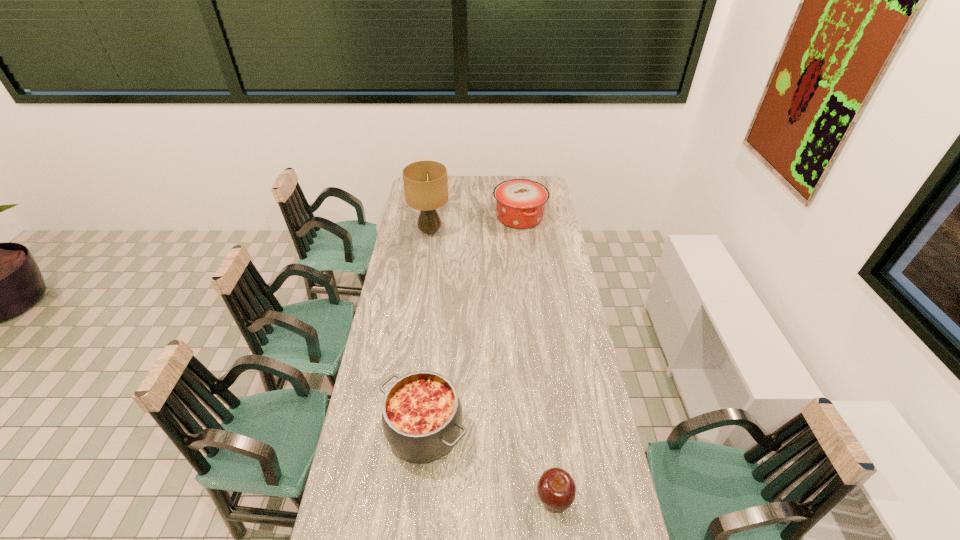
I want to click on vacant area between the left casserole and the lampshade, so click(427, 331).

The height and width of the screenshot is (540, 960). Identify the location of vacant area that lies between the nearer casserole and the right casserole. (472, 324).

The image size is (960, 540). Identify the location of unoccupied position between the third farthest object and the farther casserole. (472, 324).

Where is `empty space between the tallest object and the farther casserole`? The image size is (960, 540). empty space between the tallest object and the farther casserole is located at coordinates (475, 224).

At what (x,y) coordinates should I click in order to perform the action: click on vacant area that lies between the tallest object and the left casserole. Please return your answer as a coordinate pair (x, y). The image size is (960, 540). Looking at the image, I should click on (427, 331).

This screenshot has width=960, height=540. Find the location of `vacant space that is in between the right casserole and the apple`. vacant space that is in between the right casserole and the apple is located at coordinates (537, 357).

At what (x,y) coordinates should I click in order to perform the action: click on vacant space that's between the apple and the lampshade. Please return your answer as a coordinate pair (x, y). The width and height of the screenshot is (960, 540). Looking at the image, I should click on (492, 364).

Locate an element on the screen. This screenshot has width=960, height=540. empty location between the farther casserole and the left casserole is located at coordinates (472, 324).

Identify which object is the nearest to the left casserole. Please provide its 2D coordinates. Your answer should be formatted as a tuple, i.e. [(x, y)], where the tuple contains the x and y coordinates of a point satisfying the conditions above.

[(556, 488)]

Select which object appears as the third closest to the nearer casserole. Please provide its 2D coordinates. Your answer should be formatted as a tuple, i.e. [(x, y)], where the tuple contains the x and y coordinates of a point satisfying the conditions above.

[(520, 203)]